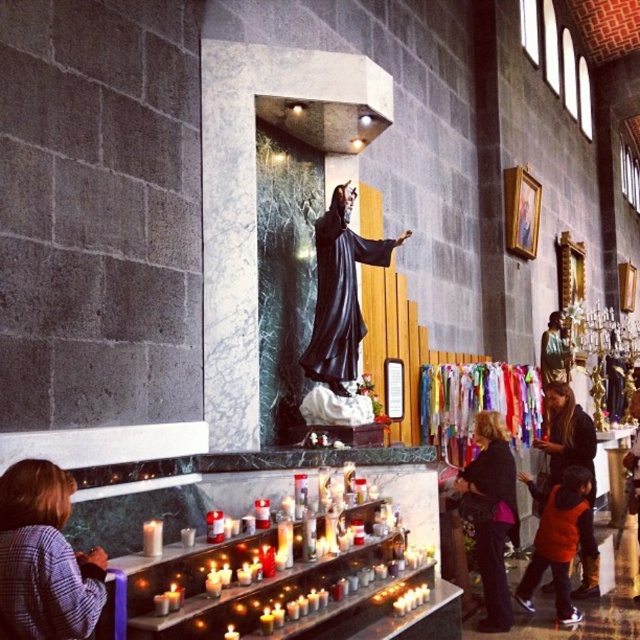
Question: Does matte black jacket at center appear under matte black statue at center?

Choices:
 (A) yes
 (B) no

Answer: (A)

Question: Observing the image, what is the correct spatial positioning of matte black jacket at center in reference to matte black statue at center?

Choices:
 (A) below
 (B) above

Answer: (A)

Question: Which of the following is the farthest from the observer?

Choices:
 (A) white wax candle at lower left
 (B) plaid shirt at lower left
 (C) matte black statue at center
 (D) matte black jacket at center

Answer: (C)

Question: Which point is closer to the camera?

Choices:
 (A) pos(17,461)
 (B) pos(492,605)

Answer: (A)

Question: Which object is the farthest from the orange fabric vest at lower right?

Choices:
 (A) plaid shirt at lower left
 (B) matte black jacket at center

Answer: (A)

Question: Does orange fabric vest at lower right have a smaller size compared to white wax candle at lower left?

Choices:
 (A) yes
 (B) no

Answer: (B)